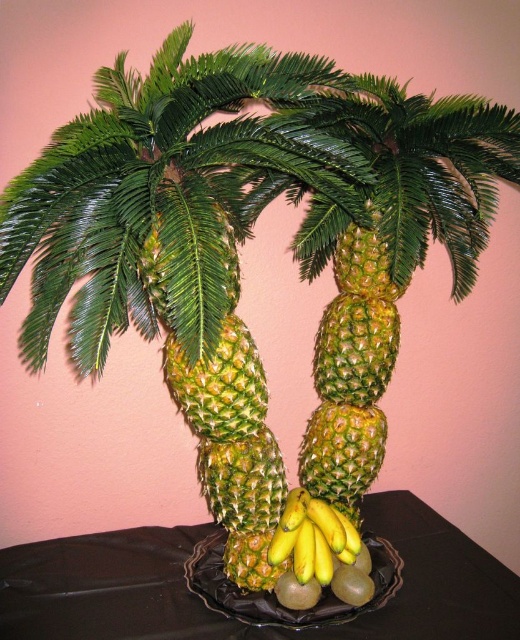
You are setting up a tropical themed party and need to arrange the black plastic tray at center and yellow smooth bananas at center. According to the scene, where should you place the bananas relative to the tray?

The black plastic tray at center is located below yellow smooth bananas at center, so you should place the bananas above the tray.

You are standing in front of a pineapple palm tree sculpture. There is a specific point marked at coordinates point (72,604). If you want to reach this point with a 36 inch long stick, will you be able to do so?

The point (72,604) is 39.37 inches away from the camera. Since the stick is only 36 inches long, it is 3.37 inches shorter than needed. Therefore, you cannot reach the point with the 36 inch stick.